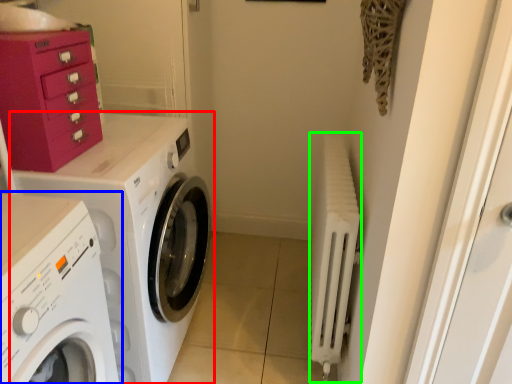
Question: Which object is the farthest from washing machine (highlighted by a red box)? Choose among these: washing machine (highlighted by a blue box) or radiator (highlighted by a green box).

Choices:
 (A) washing machine
 (B) radiator

Answer: (B)